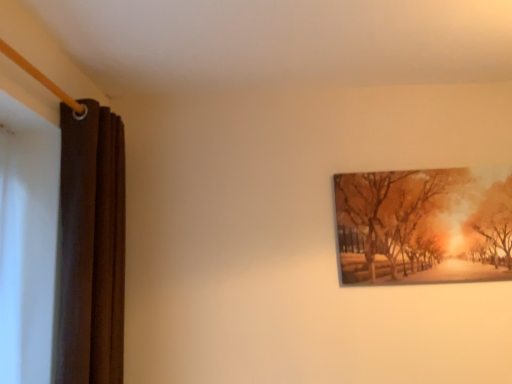
Question: Looking at their shapes, would you say matte wooden picture frame at upper right is wider or thinner than brown velvet curtain at left?

Choices:
 (A) thin
 (B) wide

Answer: (A)

Question: Is matte wooden picture frame at upper right inside the boundaries of brown velvet curtain at left, or outside?

Choices:
 (A) inside
 (B) outside

Answer: (B)

Question: From a real-world perspective, relative to brown velvet curtain at left, is matte wooden picture frame at upper right vertically above or below?

Choices:
 (A) below
 (B) above

Answer: (B)

Question: From a real-world perspective, is brown velvet curtain at left above or below matte wooden picture frame at upper right?

Choices:
 (A) above
 (B) below

Answer: (B)

Question: In the image, is brown velvet curtain at left positioned in front of or behind matte wooden picture frame at upper right?

Choices:
 (A) front
 (B) behind

Answer: (A)

Question: From the image's perspective, relative to matte wooden picture frame at upper right, is brown velvet curtain at left above or below?

Choices:
 (A) below
 (B) above

Answer: (A)

Question: Visually, is brown velvet curtain at left positioned to the left or to the right of matte wooden picture frame at upper right?

Choices:
 (A) right
 (B) left

Answer: (B)